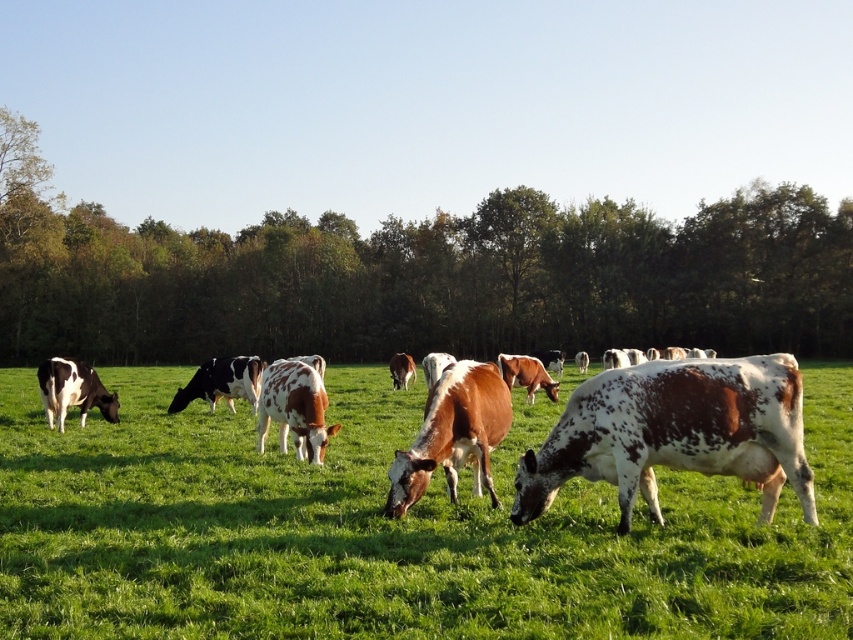
Does speckled brown cow at center have a larger size compared to black and white spotted cow at center?

No, speckled brown cow at center is not bigger than black and white spotted cow at center.

Consider the image. Which of these two, speckled brown cow at center or black and white spotted cow at center, stands taller?

speckled brown cow at center is taller.

The height and width of the screenshot is (640, 853). Find the location of `speckled brown cow at center`. speckled brown cow at center is located at coordinates (675, 433).

Find the location of a particular element. speckled brown cow at center is located at coordinates (675, 433).

Describe the element at coordinates (390, 531) in the screenshot. I see `green grassy field at center` at that location.

Is point (347, 488) positioned after point (793, 380)?

Yes.

I want to click on green grassy field at center, so click(x=390, y=531).

Can you confirm if brown speckled cow at center is positioned to the right of black and white spotted cow at center?

Correct, you'll find brown speckled cow at center to the right of black and white spotted cow at center.

Is brown speckled cow at center thinner than black and white spotted cow at center?

Indeed, brown speckled cow at center has a lesser width compared to black and white spotted cow at center.

Is point (405, 496) positioned before point (231, 368)?

Yes, point (405, 496) is in front of point (231, 368).

You are a GUI agent. You are given a task and a screenshot of the screen. Output one action in this format:
    pyautogui.click(x=<x>, y=<y>)
    Task: Click on the brown speckled cow at center
    
    Given the screenshot: What is the action you would take?
    pyautogui.click(x=453, y=435)